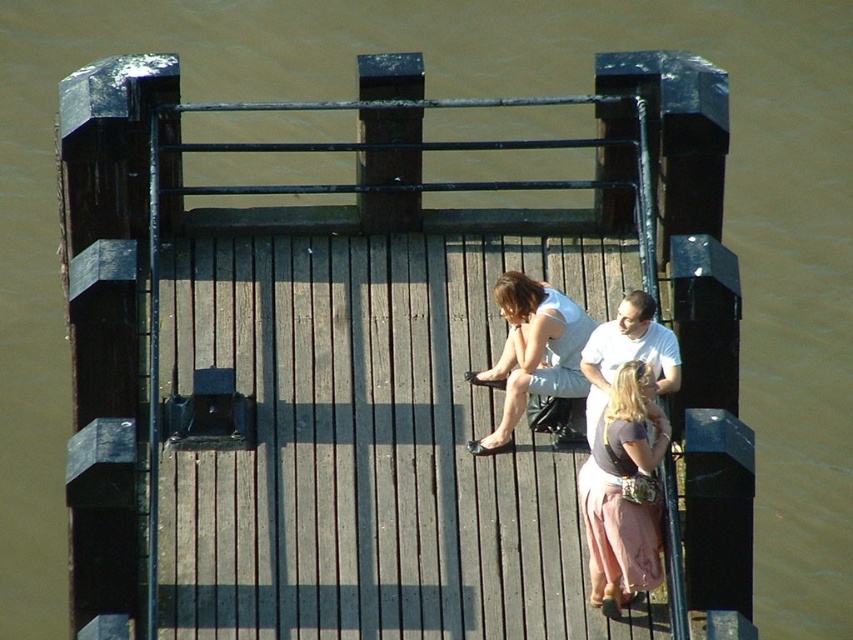
You are standing at point A, which is at coordinates point A at (648, 461). You want to walk to point B, which is 63.64 feet away. Is there enough space for you to walk from point A to point B on the wooden platform?

Yes, there is enough space to walk from point A to point B on the wooden platform since the platform is a flat surface with no obstructions mentioned, and the distance between them is 63.64 feet.

You are standing on the wooden platform and notice two items at the center. The matte pink skirt at center and the white cotton shirt at center. Which item is closer to the water below?

The matte pink skirt at center is positioned under the white cotton shirt at center, so the matte pink skirt at center is closer to the water below.